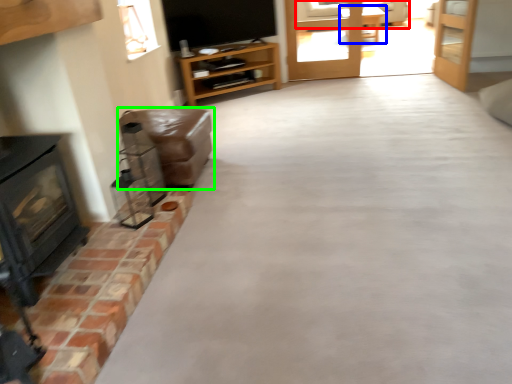
Question: Estimate the real-world distances between objects in this image. Which object is farther from couch (highlighted by a red box), table (highlighted by a blue box) or furniture (highlighted by a green box)?

Choices:
 (A) table
 (B) furniture

Answer: (B)